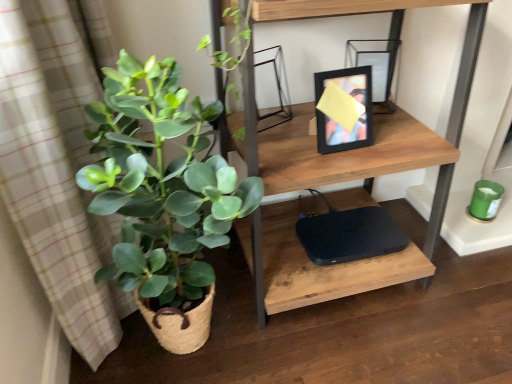
Question: Is black matte computer at lower center further to the viewer compared to green woven basket at left?

Choices:
 (A) yes
 (B) no

Answer: (A)

Question: Is black matte computer at lower center oriented towards green woven basket at left?

Choices:
 (A) no
 (B) yes

Answer: (A)

Question: From the image's perspective, is black matte computer at lower center beneath green woven basket at left?

Choices:
 (A) yes
 (B) no

Answer: (A)

Question: Can you confirm if black matte computer at lower center is wider than green woven basket at left?

Choices:
 (A) yes
 (B) no

Answer: (B)

Question: From a real-world perspective, is black matte computer at lower center below green woven basket at left?

Choices:
 (A) no
 (B) yes

Answer: (B)

Question: From a real-world perspective, is black matte computer at lower center physically above green woven basket at left?

Choices:
 (A) yes
 (B) no

Answer: (B)

Question: Can you confirm if wooden shelf at upper center is shorter than green woven basket at left?

Choices:
 (A) yes
 (B) no

Answer: (B)

Question: Is wooden shelf at upper center wider than green woven basket at left?

Choices:
 (A) yes
 (B) no

Answer: (A)

Question: From the image's perspective, is wooden shelf at upper center located above green woven basket at left?

Choices:
 (A) no
 (B) yes

Answer: (B)

Question: Is wooden shelf at upper center not near green woven basket at left?

Choices:
 (A) no
 (B) yes

Answer: (A)

Question: Is wooden shelf at upper center at the left side of green woven basket at left?

Choices:
 (A) yes
 (B) no

Answer: (B)

Question: From a real-world perspective, is wooden shelf at upper center on top of green woven basket at left?

Choices:
 (A) no
 (B) yes

Answer: (B)

Question: Is wooden shelf at upper center to the right of black matte computer at lower center from the viewer's perspective?

Choices:
 (A) yes
 (B) no

Answer: (B)